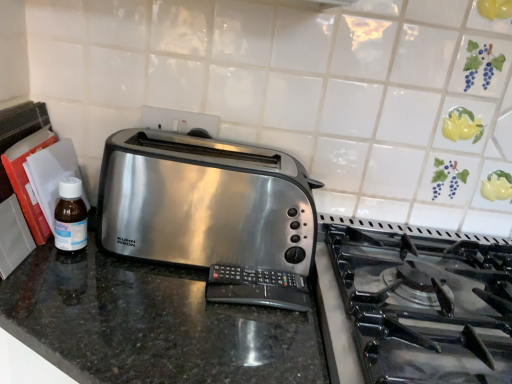
The width and height of the screenshot is (512, 384). What are the coordinates of `vacant space situated above shiny granite counter at center (from a real-world perspective)` in the screenshot? It's located at (193, 307).